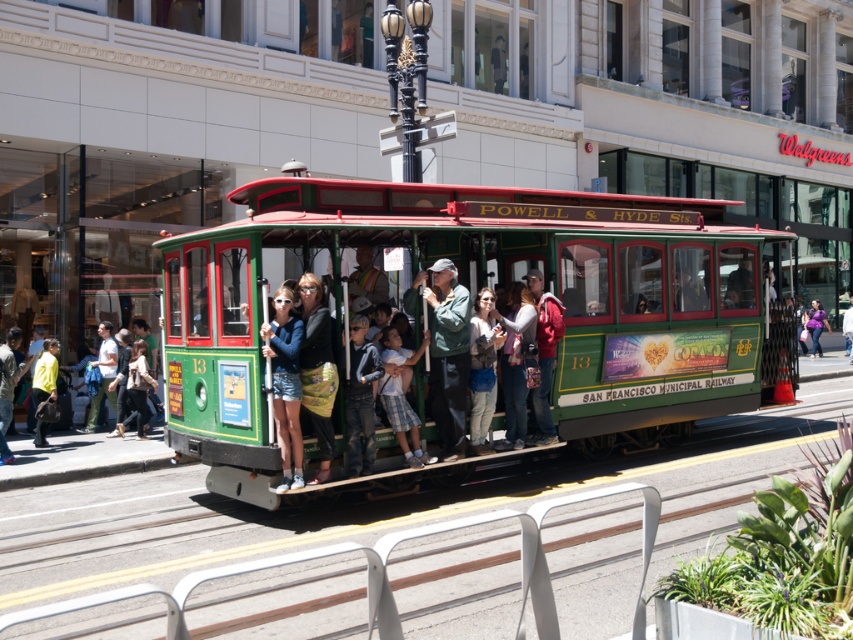
Does green polished wood cable car at center have a larger size compared to matte blue jacket at center?

Incorrect, green polished wood cable car at center is not larger than matte blue jacket at center.

Which of these two, green polished wood cable car at center or matte blue jacket at center, stands shorter?

green polished wood cable car at center is shorter.

Between point (256, 294) and point (294, 339), which one is positioned in front?

Positioned in front is point (256, 294).

Locate an element on the screen. The height and width of the screenshot is (640, 853). green polished wood cable car at center is located at coordinates (473, 301).

Is point (657, 387) in front of point (817, 310)?

That is True.

In order to click on green polished wood cable car at center in this screenshot , I will do `click(473, 301)`.

Does green polished wood cable car at center appear over green fabric coach at center?

Correct, green polished wood cable car at center is located above green fabric coach at center.

Does point (467, 292) come in front of point (444, 372)?

Yes, point (467, 292) is in front of point (444, 372).

I want to click on green polished wood cable car at center, so click(x=473, y=301).